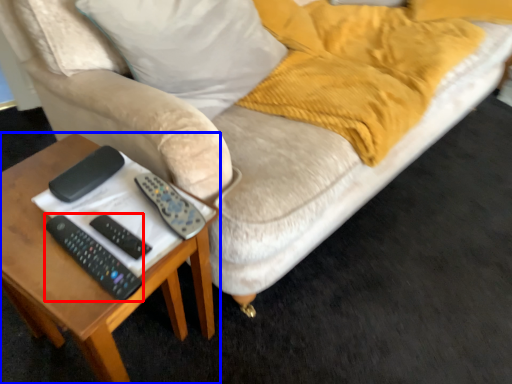
Question: Among these objects, which one is farthest to the camera, remote (highlighted by a red box) or table (highlighted by a blue box)?

Choices:
 (A) remote
 (B) table

Answer: (A)